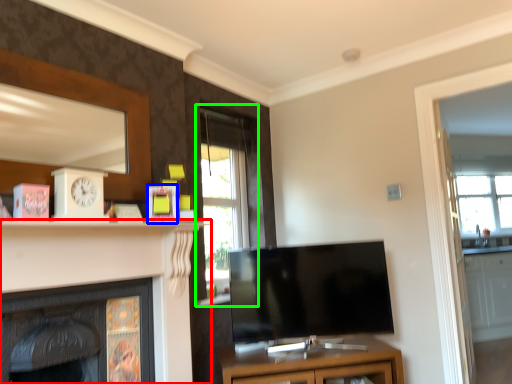
Question: Which is farther away from fireplace (highlighted by a red box)? picture frame (highlighted by a blue box) or window (highlighted by a green box)?

Choices:
 (A) picture frame
 (B) window

Answer: (B)